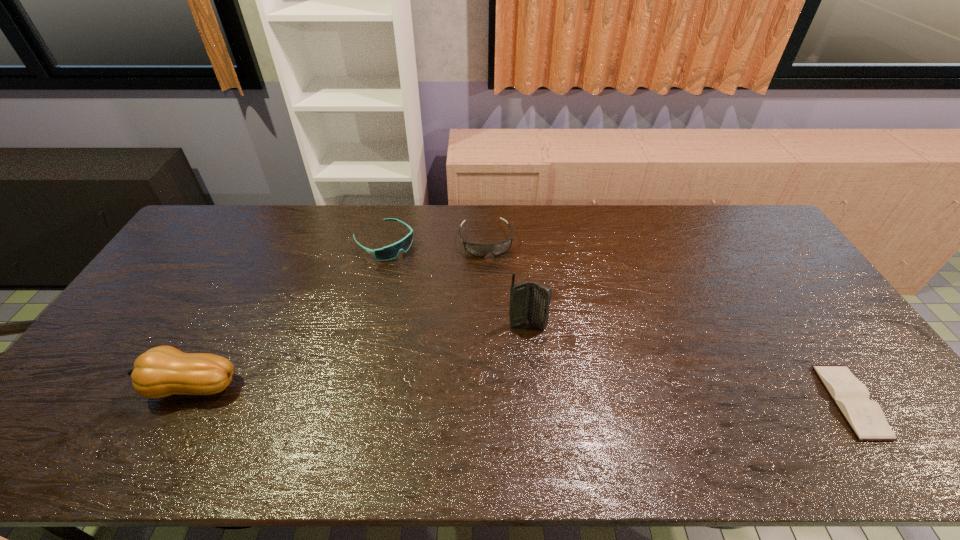
Identify the location of blank area located on the lenses of the goggles. This screenshot has width=960, height=540. (507, 348).

Image resolution: width=960 pixels, height=540 pixels. I want to click on vacant space located on the lenses of the goggles, so click(x=493, y=278).

Identify the location of free space located on the lenses of the goggles. Image resolution: width=960 pixels, height=540 pixels. (492, 276).

Where is `vacant region located on the keyboard of the cellular telephone`? vacant region located on the keyboard of the cellular telephone is located at coordinates (592, 418).

At what (x,y) coordinates should I click in order to perform the action: click on free location located 0.170m on the keyboard of the cellular telephone. Please return your answer as a coordinate pair (x, y). Looking at the image, I should click on click(566, 379).

Image resolution: width=960 pixels, height=540 pixels. Find the location of `free space located 0.270m on the keyboard of the cellular telephone`. free space located 0.270m on the keyboard of the cellular telephone is located at coordinates (588, 411).

What are the coordinates of `vacant position located on the front-facing side of the sunglasses` in the screenshot? It's located at (422, 273).

This screenshot has width=960, height=540. Identify the location of vacant space located on the front-facing side of the sunglasses. (447, 293).

Where is `free region located on the front-facing side of the sunglasses`? This screenshot has width=960, height=540. free region located on the front-facing side of the sunglasses is located at coordinates (447, 293).

Locate an element on the screen. goggles at the far edge is located at coordinates (480, 250).